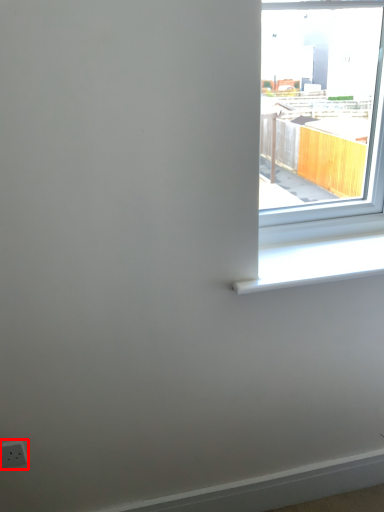
Question: From the image's perspective, where is electric outlet (annotated by the red box) located in relation to window sill in the image?

Choices:
 (A) below
 (B) above

Answer: (A)